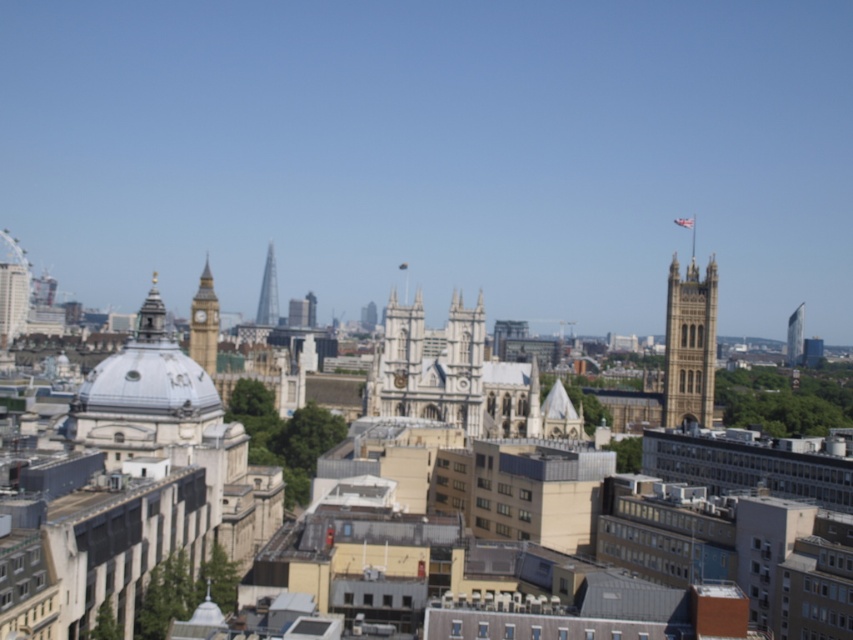
Question: Where is golden stone tower at upper right located in relation to glassy reflective tower at upper right in the image?

Choices:
 (A) left
 (B) right

Answer: (A)

Question: Which of these objects is positioned closest to the glassy reflective tower at upper right?

Choices:
 (A) golden stone clock tower at left
 (B) glassy steel tower at center

Answer: (B)

Question: Is golden stone clock tower at left positioned before glassy steel tower at center?

Choices:
 (A) yes
 (B) no

Answer: (A)

Question: Which point is farther from the camera taking this photo?

Choices:
 (A) (206, 276)
 (B) (271, 321)
 (C) (676, 380)
 (D) (799, 317)

Answer: (B)

Question: Is golden stone clock tower at left below glassy reflective tower at upper right?

Choices:
 (A) yes
 (B) no

Answer: (B)

Question: Estimate the real-world distances between objects in this image. Which object is farther from the golden stone clock tower at left?

Choices:
 (A) golden stone tower at upper right
 (B) glassy steel tower at center
 (C) glassy reflective tower at upper right

Answer: (C)